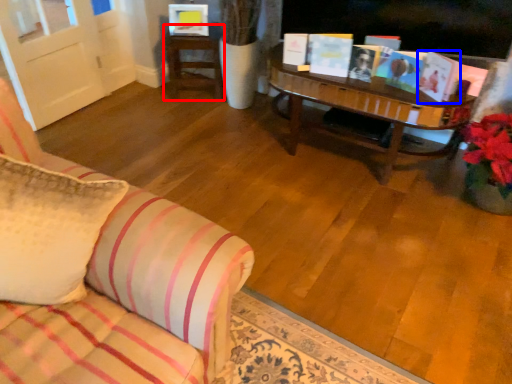
Question: Which object appears closest to the camera in this image, table (highlighted by a red box) or book (highlighted by a blue box)?

Choices:
 (A) table
 (B) book

Answer: (B)